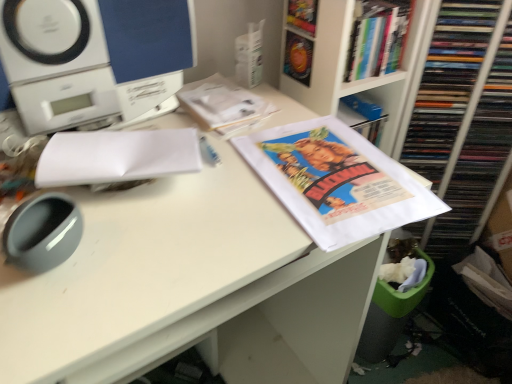
This screenshot has width=512, height=384. I want to click on vacant space underneath white paper at left (from a real-world perspective), so click(x=135, y=187).